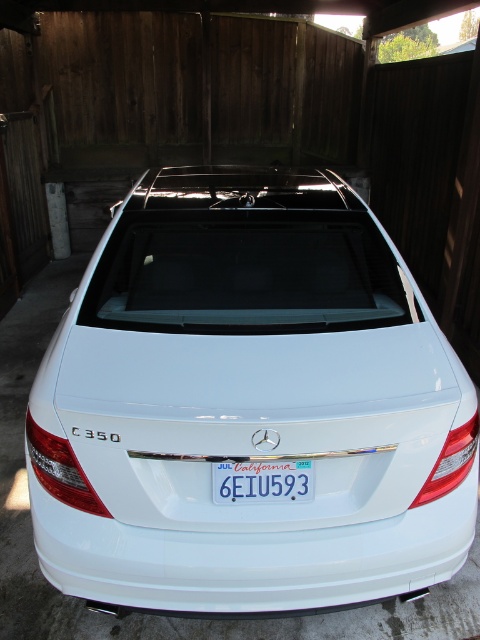
You are standing in the garage and want to take a photo of the white glossy sedan at center. Where should you position yourself to capture the entire car in the frame?

To capture the entire white glossy sedan at center in the frame, position yourself at the center of the garage, aligned with the car. Since the car is located at point (249, 404), this central positioning will ensure the car is centered and fully visible in the photo.